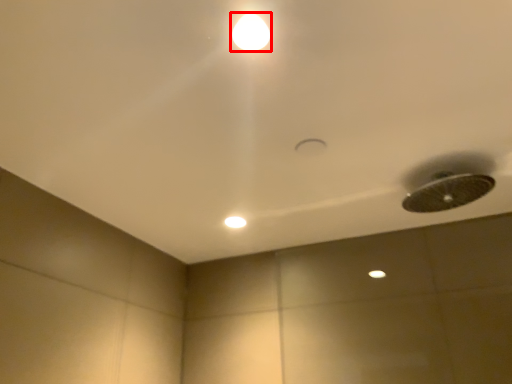
Question: From the image's perspective, where is lamp (annotated by the red box) located relative to dot?

Choices:
 (A) above
 (B) below

Answer: (A)